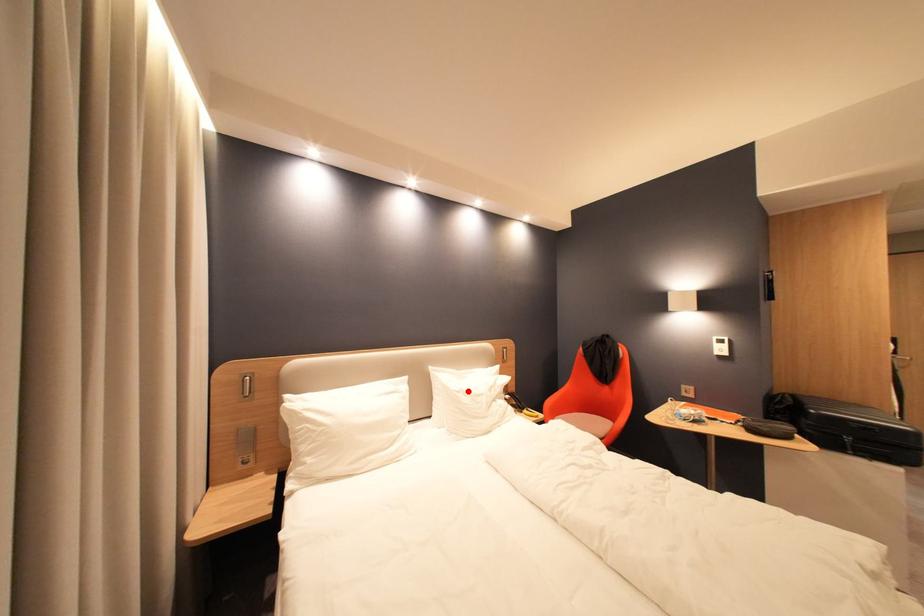
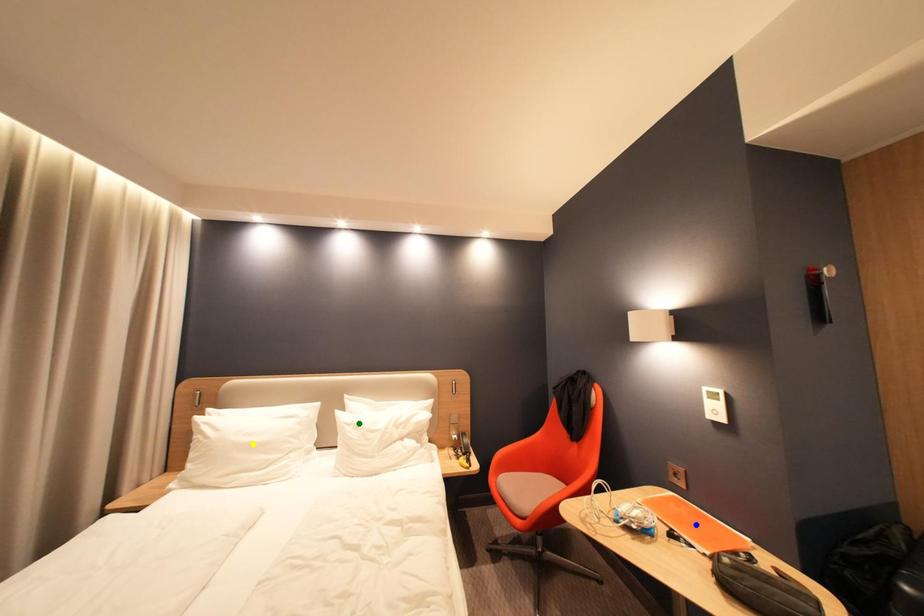
Question: I am providing you with two images of the same scene from different viewpoints. A red point is marked on the first image. You are given multiple points on the second image. Which spot in image 2 lines up with the point in image 1?

Choices:
 (A) blue point
 (B) green point
 (C) yellow point

Answer: (B)